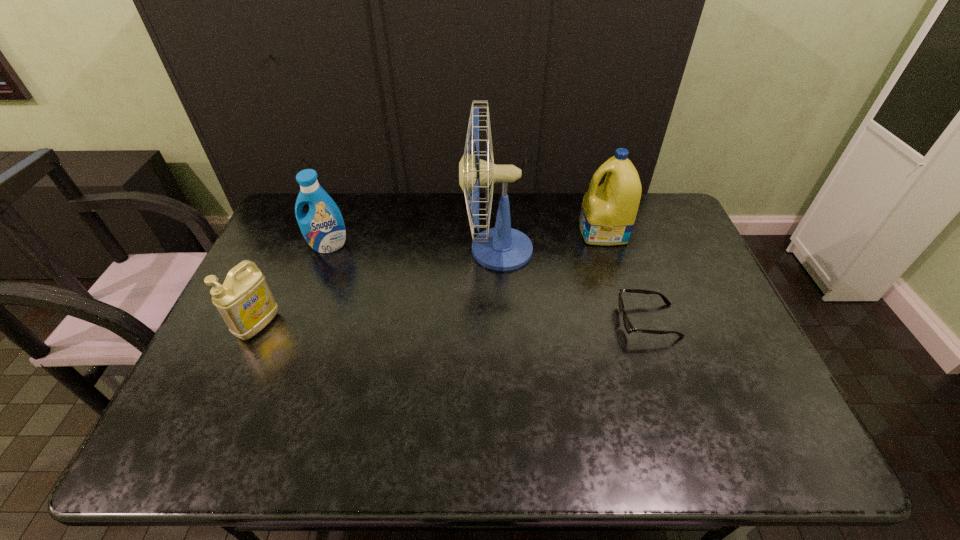
Locate an element on the screen. The height and width of the screenshot is (540, 960). object that stands as the second closest to the spectacles is located at coordinates (608, 212).

Where is `detergent object that ranks as the second closest to the shortest object`? Image resolution: width=960 pixels, height=540 pixels. detergent object that ranks as the second closest to the shortest object is located at coordinates (323, 228).

Identify the location of the third closest detergent to the third object from left to right. (245, 302).

Find the location of a particular element. The width and height of the screenshot is (960, 540). free space that satisfies the following two spatial constraints: 1. on the lenses of the shortest object; 2. on the front side of the shortest detergent is located at coordinates (649, 325).